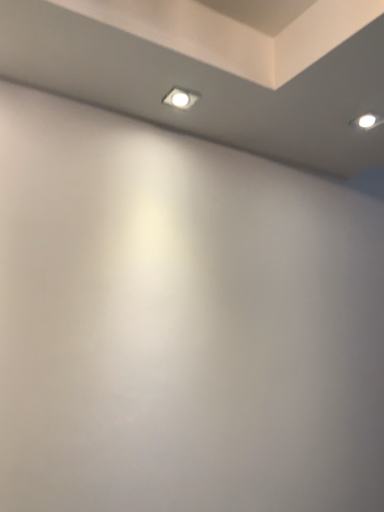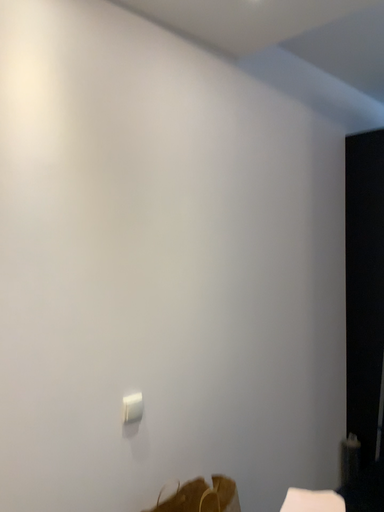
Question: Which way did the camera rotate in the video?

Choices:
 (A) rotated right
 (B) rotated left

Answer: (A)